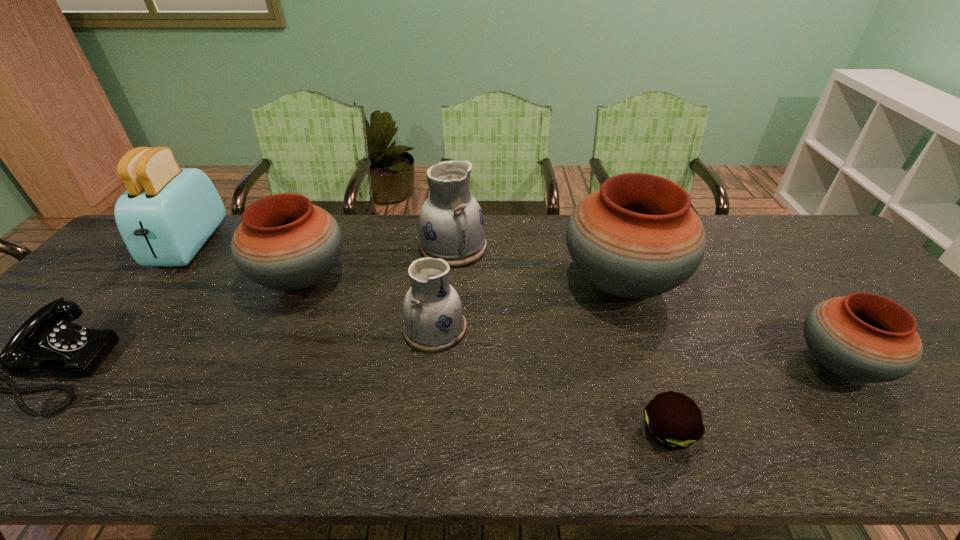
This screenshot has height=540, width=960. I want to click on free region that satisfies the following two spatial constraints: 1. on the side of the toaster with the lever; 2. on the right side of the smaller blue pottery, so click(119, 328).

I want to click on vacant space that satisfies the following two spatial constraints: 1. on the side of the light toaster with the lever; 2. on the right side of the shortest object, so click(34, 431).